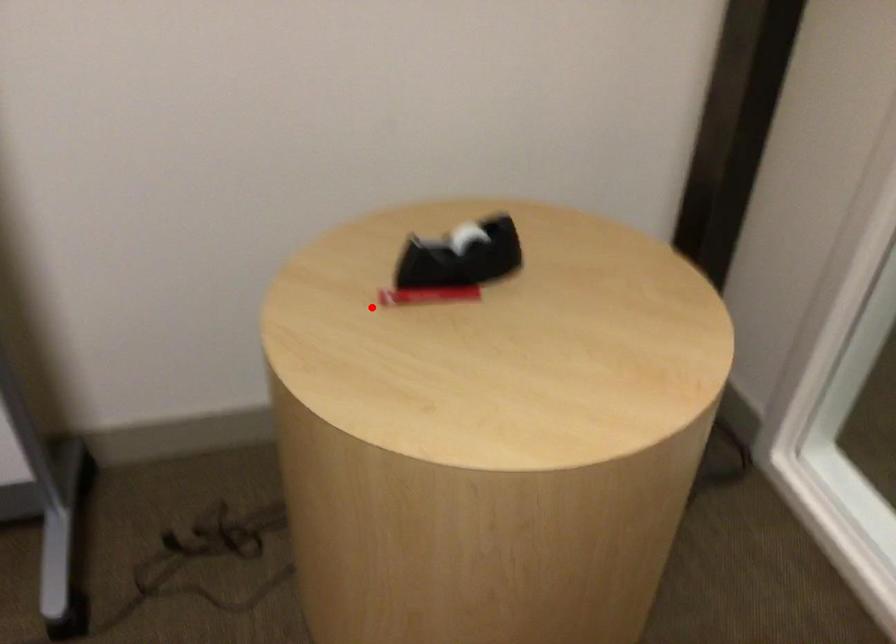
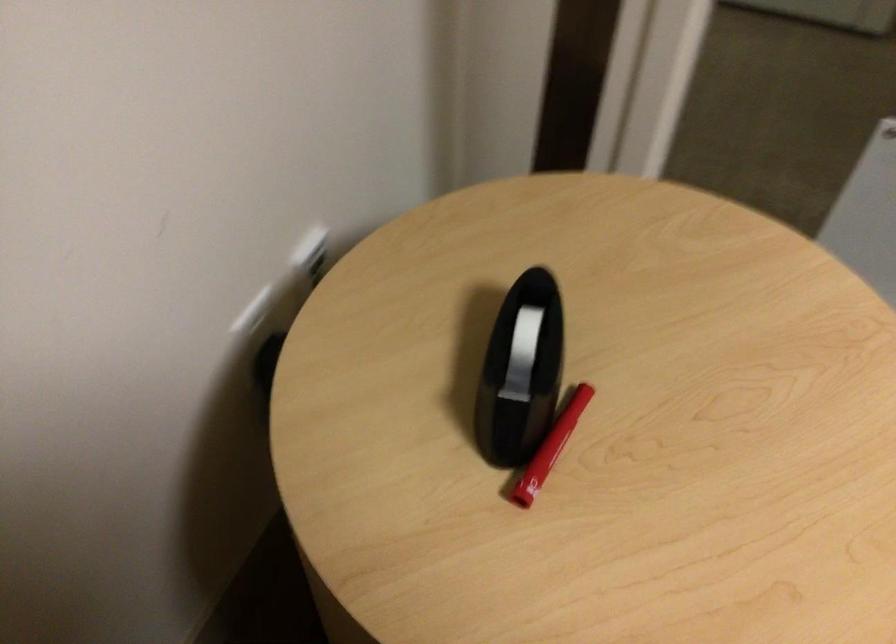
Question: I am providing you with two images of the same scene from different viewpoints. Image1 has a red point marked. In image2, the corresponding 3D location appears at what relative position? Reply with the corresponding letter.

Choices:
 (A) Closer
 (B) Farther

Answer: (A)